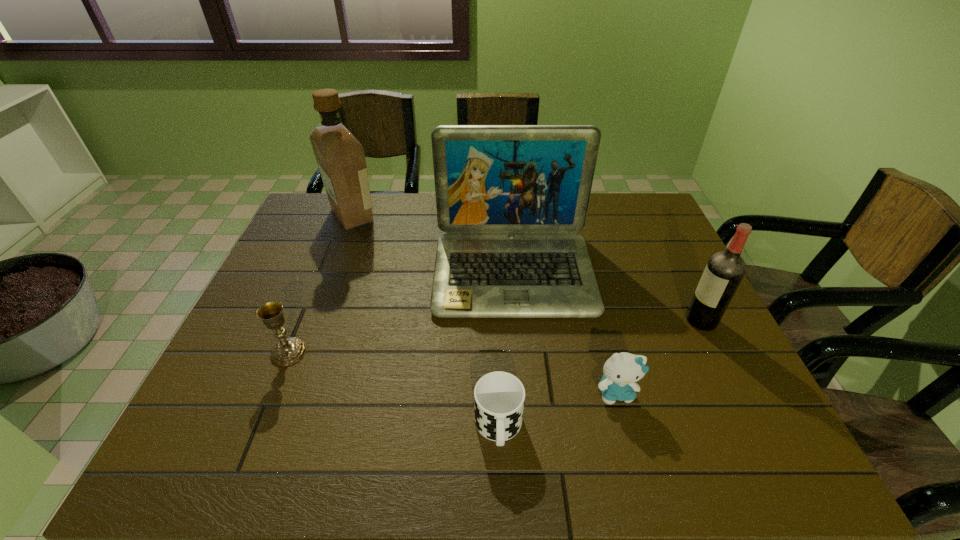
At what (x,y) coordinates should I click in order to perform the action: click on the farthest object. Please return your answer as a coordinate pair (x, y). The image size is (960, 540). Looking at the image, I should click on (340, 157).

This screenshot has width=960, height=540. I want to click on the left liquor, so click(x=340, y=157).

The height and width of the screenshot is (540, 960). Identify the location of laptop computer. (510, 198).

Identify the location of the third tallest object. (724, 271).

Locate an element on the screen. This screenshot has height=540, width=960. the rightmost object is located at coordinates (724, 271).

Identify the location of chalice. This screenshot has width=960, height=540. (288, 351).

Identify the location of the third shortest object. (288, 351).

Where is `the fifth tallest object`? Image resolution: width=960 pixels, height=540 pixels. the fifth tallest object is located at coordinates (621, 371).

This screenshot has width=960, height=540. In order to click on the shortest object in this screenshot , I will do `click(499, 397)`.

The height and width of the screenshot is (540, 960). What are the coordinates of `blank area located 0.090m on the front-facing side of the farther liquor` in the screenshot? It's located at (407, 215).